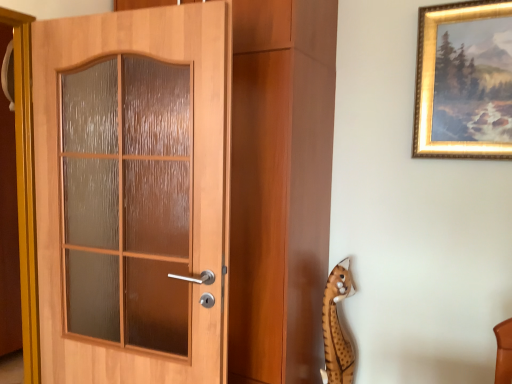
Question: Is spotted plush toy at lower right spatially inside wooden door at left, or outside of it?

Choices:
 (A) outside
 (B) inside

Answer: (A)

Question: Looking at their shapes, would you say spotted plush toy at lower right is wider or thinner than wooden door at left?

Choices:
 (A) thin
 (B) wide

Answer: (A)

Question: Based on their relative distances, which object is nearer to the wooden door at left?

Choices:
 (A) gold-framed painting at upper right
 (B) spotted plush toy at lower right

Answer: (B)

Question: Which object is positioned farthest from the gold-framed painting at upper right?

Choices:
 (A) spotted plush toy at lower right
 (B) wooden door at left

Answer: (B)